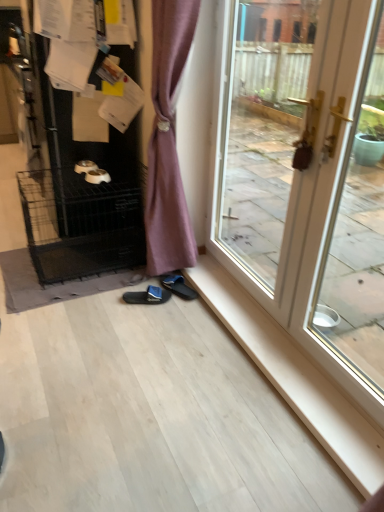
Question: Considering the relative sizes of black wire dog crate at left and black wire cage at left in the image provided, is black wire dog crate at left wider than black wire cage at left?

Choices:
 (A) yes
 (B) no

Answer: (B)

Question: Is black wire dog crate at left at the right side of black wire cage at left?

Choices:
 (A) no
 (B) yes

Answer: (A)

Question: From the image's perspective, does black wire dog crate at left appear higher than black wire cage at left?

Choices:
 (A) yes
 (B) no

Answer: (A)

Question: Is black wire dog crate at left closer to camera compared to black wire cage at left?

Choices:
 (A) no
 (B) yes

Answer: (B)

Question: Would you consider black wire dog crate at left to be distant from black wire cage at left?

Choices:
 (A) yes
 (B) no

Answer: (B)

Question: Is black fabric slipper at lower center, which is counted as the 1th footwear, starting from the left, in front of or behind black fabric slipper at lower center, which appears as the 2th footwear when viewed from the left, in the image?

Choices:
 (A) front
 (B) behind

Answer: (A)

Question: From the image's perspective, relative to black fabric slipper at lower center, which appears as the 2th footwear when viewed from the left, is black fabric slipper at lower center, which is counted as the 1th footwear, starting from the left, above or below?

Choices:
 (A) below
 (B) above

Answer: (A)

Question: Do you think black fabric slipper at lower center, the 2th footwear in the right-to-left sequence, is within black fabric slipper at lower center, which appears as the 2th footwear when viewed from the left, or outside of it?

Choices:
 (A) inside
 (B) outside

Answer: (B)

Question: Considering the positions of black fabric slipper at lower center, which is counted as the 1th footwear, starting from the left, and black fabric slipper at lower center, which appears as the 2th footwear when viewed from the left, in the image, is black fabric slipper at lower center, which is counted as the 1th footwear, starting from the left, bigger or smaller than black fabric slipper at lower center, which appears as the 2th footwear when viewed from the left,?

Choices:
 (A) small
 (B) big

Answer: (A)

Question: From the image's perspective, relative to white glossy screen door at right, is white glossy door at right above or below?

Choices:
 (A) below
 (B) above

Answer: (B)

Question: In terms of height, does white glossy door at right look taller or shorter compared to white glossy screen door at right?

Choices:
 (A) tall
 (B) short

Answer: (A)

Question: Visually, is white glossy door at right positioned to the left or to the right of white glossy screen door at right?

Choices:
 (A) right
 (B) left

Answer: (B)

Question: Considering the positions of point (254, 256) and point (339, 286), is point (254, 256) closer or farther from the camera than point (339, 286)?

Choices:
 (A) closer
 (B) farther

Answer: (B)

Question: Looking at the image, does black wire dog crate at left seem bigger or smaller compared to black wire cage at left?

Choices:
 (A) big
 (B) small

Answer: (A)

Question: In terms of width, does black wire dog crate at left look wider or thinner when compared to black wire cage at left?

Choices:
 (A) thin
 (B) wide

Answer: (A)